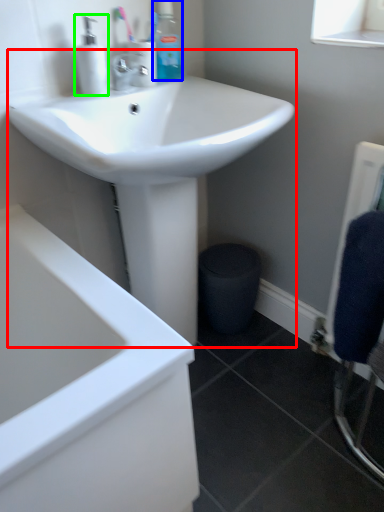
Question: Estimate the real-world distances between objects in this image. Which object is farther from sink (highlighted by a red box), toiletry (highlighted by a blue box) or soap dispenser (highlighted by a green box)?

Choices:
 (A) toiletry
 (B) soap dispenser

Answer: (A)